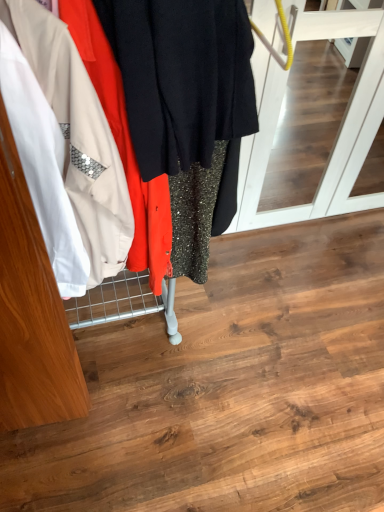
At what (x,y) coordinates should I click in order to perform the action: click on vacant area to the right of metallic sequined dress at left. Please return your answer as a coordinate pair (x, y). Looking at the image, I should click on (254, 336).